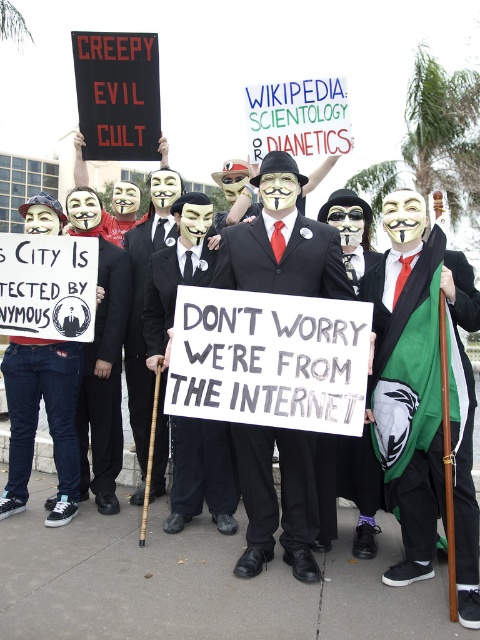
Question: Which of the following is the farthest from the observer?

Choices:
 (A) (243, 435)
 (B) (63, 362)

Answer: (B)

Question: Can you confirm if matte black suit at center is positioned to the left of denim jeans at lower left?

Choices:
 (A) no
 (B) yes

Answer: (A)

Question: Is matte black suit at center below denim jeans at lower left?

Choices:
 (A) no
 (B) yes

Answer: (B)

Question: Does matte black suit at center appear on the right side of denim jeans at lower left?

Choices:
 (A) no
 (B) yes

Answer: (B)